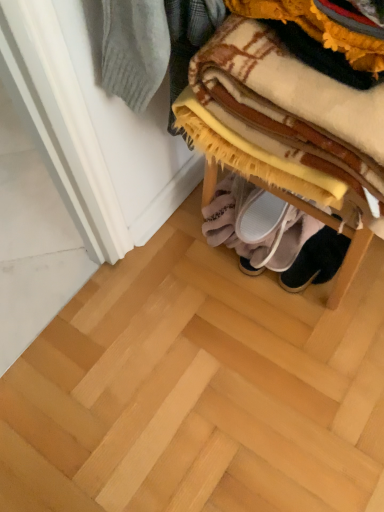
Question: Is white fabric slipper at lower center, which ranks as the second footwear in right-to-left order, facing away from plaid fabric blanket at upper right?

Choices:
 (A) no
 (B) yes

Answer: (A)

Question: From a real-world perspective, does white fabric slipper at lower center, positioned as the 1th footwear in left-to-right order, sit lower than plaid fabric blanket at upper right?

Choices:
 (A) no
 (B) yes

Answer: (B)

Question: Is the position of white fabric slipper at lower center, which ranks as the second footwear in right-to-left order, more distant than that of plaid fabric blanket at upper right?

Choices:
 (A) yes
 (B) no

Answer: (A)

Question: Considering the relative sizes of white fabric slipper at lower center, positioned as the 1th footwear in left-to-right order, and plaid fabric blanket at upper right in the image provided, is white fabric slipper at lower center, positioned as the 1th footwear in left-to-right order, shorter than plaid fabric blanket at upper right?

Choices:
 (A) yes
 (B) no

Answer: (A)

Question: From the image's perspective, is plaid fabric blanket at upper right located above or below black suede shoes at lower center, placed as the second footwear when sorted from left to right?

Choices:
 (A) below
 (B) above

Answer: (B)

Question: Considering their positions, is plaid fabric blanket at upper right located in front of or behind black suede shoes at lower center, which ranks as the first footwear in right-to-left order?

Choices:
 (A) behind
 (B) front

Answer: (B)

Question: From a real-world perspective, is plaid fabric blanket at upper right positioned above or below black suede shoes at lower center, placed as the second footwear when sorted from left to right?

Choices:
 (A) below
 (B) above

Answer: (B)

Question: Does point (246, 53) appear closer or farther from the camera than point (339, 246)?

Choices:
 (A) closer
 (B) farther

Answer: (A)

Question: Is point (263, 134) positioned closer to the camera than point (201, 451)?

Choices:
 (A) closer
 (B) farther

Answer: (A)

Question: In terms of size, does plaid fabric blanket at upper right appear bigger or smaller than wooden shoe rack at lower right?

Choices:
 (A) big
 (B) small

Answer: (A)

Question: Relative to wooden shoe rack at lower right, is plaid fabric blanket at upper right in front or behind?

Choices:
 (A) front
 (B) behind

Answer: (A)

Question: Is plaid fabric blanket at upper right situated inside wooden shoe rack at lower right or outside?

Choices:
 (A) inside
 (B) outside

Answer: (B)

Question: In terms of size, does wooden shoe rack at lower right appear bigger or smaller than plaid fabric blanket at upper right?

Choices:
 (A) big
 (B) small

Answer: (B)

Question: From the image's perspective, is wooden shoe rack at lower right located above or below plaid fabric blanket at upper right?

Choices:
 (A) above
 (B) below

Answer: (B)